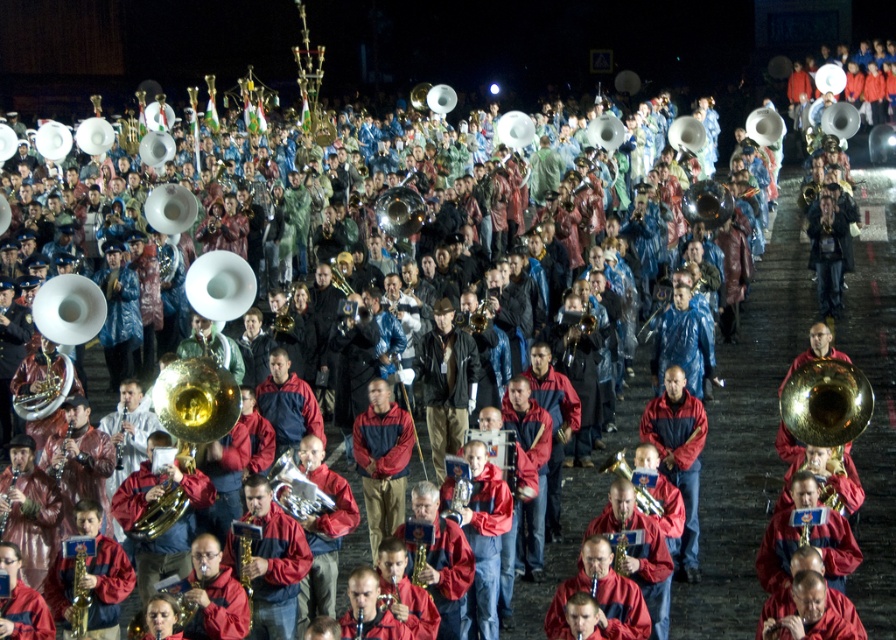
Is gold brass saxophone at center above gold brass tuba at center?

Actually, gold brass saxophone at center is below gold brass tuba at center.

Who is shorter, gold brass saxophone at center or gold brass tuba at center?

gold brass saxophone at center

Between point (11, 472) and point (123, 433), which one is positioned in front?

Point (11, 472)

The height and width of the screenshot is (640, 896). I want to click on gold brass saxophone at center, so click(x=11, y=483).

Which is more to the right, brass shiny trumpet at center or gold brass saxophone at lower left?

Positioned to the right is brass shiny trumpet at center.

This screenshot has height=640, width=896. Find the location of `brass shiny trumpet at center`. brass shiny trumpet at center is located at coordinates (296, 490).

Identify the location of brass shiny trumpet at center. (296, 490).

Which is more to the left, brass shiny trumpet at center or gold brass saxophone at center?

From the viewer's perspective, gold brass saxophone at center appears more on the left side.

Is brass shiny trumpet at center taller than gold brass saxophone at center?

Yes, brass shiny trumpet at center is taller than gold brass saxophone at center.

Between point (282, 492) and point (4, 497), which one is positioned behind?

Positioned behind is point (4, 497).

Identify the location of brass shiny trumpet at center. This screenshot has width=896, height=640. (296, 490).